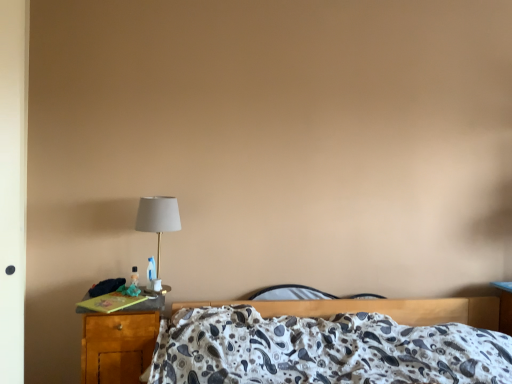
Question: From the image's perspective, does wooden nightstand at lower left appear lower than patterned fabric bed at center?

Choices:
 (A) no
 (B) yes

Answer: (A)

Question: From the image's perspective, is wooden nightstand at lower left on patterned fabric bed at center?

Choices:
 (A) yes
 (B) no

Answer: (A)

Question: From a real-world perspective, is wooden nightstand at lower left physically below patterned fabric bed at center?

Choices:
 (A) yes
 (B) no

Answer: (B)

Question: Considering the relative positions of wooden nightstand at lower left and patterned fabric bed at center in the image provided, is wooden nightstand at lower left in front of patterned fabric bed at center?

Choices:
 (A) no
 (B) yes

Answer: (A)

Question: From a real-world perspective, is wooden nightstand at lower left physically above patterned fabric bed at center?

Choices:
 (A) yes
 (B) no

Answer: (A)

Question: Is wooden nightstand at lower left wider than patterned fabric bed at center?

Choices:
 (A) no
 (B) yes

Answer: (A)

Question: Is matte gold table lamp at left smaller than patterned fabric bed at center?

Choices:
 (A) yes
 (B) no

Answer: (A)

Question: From the image's perspective, is matte gold table lamp at left over patterned fabric bed at center?

Choices:
 (A) no
 (B) yes

Answer: (B)

Question: From a real-world perspective, is matte gold table lamp at left over patterned fabric bed at center?

Choices:
 (A) yes
 (B) no

Answer: (A)

Question: Does matte gold table lamp at left contain patterned fabric bed at center?

Choices:
 (A) no
 (B) yes

Answer: (A)

Question: From the image's perspective, would you say matte gold table lamp at left is shown under patterned fabric bed at center?

Choices:
 (A) no
 (B) yes

Answer: (A)

Question: Is matte gold table lamp at left wider than patterned fabric bed at center?

Choices:
 (A) yes
 (B) no

Answer: (B)

Question: From a real-world perspective, is wooden nightstand at lower left positioned under matte gold table lamp at left based on gravity?

Choices:
 (A) no
 (B) yes

Answer: (B)